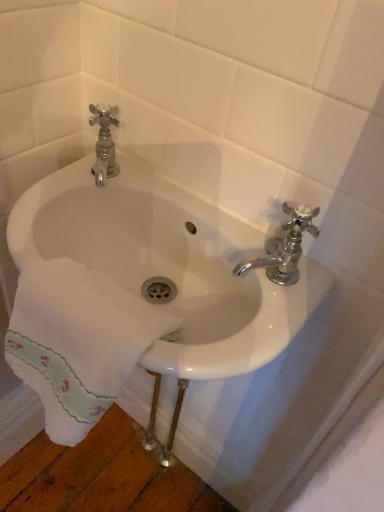
Question: Is white ceramic sink at center wider or thinner than white embroidered towel at lower left?

Choices:
 (A) thin
 (B) wide

Answer: (B)

Question: From their relative heights in the image, would you say white ceramic sink at center is taller or shorter than white embroidered towel at lower left?

Choices:
 (A) tall
 (B) short

Answer: (B)

Question: Which of these objects is positioned farthest from the white ceramic sink at center?

Choices:
 (A) chrome metallic faucet at upper right
 (B) white embroidered towel at lower left

Answer: (A)

Question: Which is farther from the chrome metallic faucet at upper right?

Choices:
 (A) white ceramic sink at center
 (B) white embroidered towel at lower left

Answer: (B)